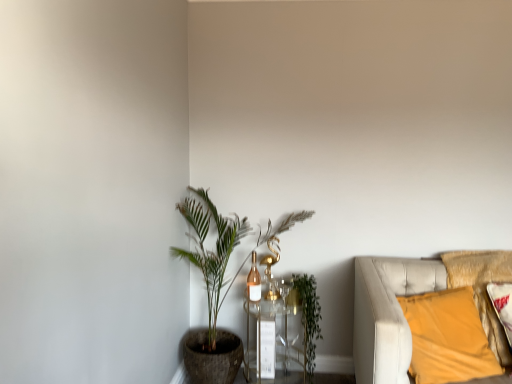
What do you see at coordinates (402, 312) in the screenshot? The image size is (512, 384). I see `velvet yellow pillow at right` at bounding box center [402, 312].

At what (x,y) coordinates should I click in order to perform the action: click on green leafy plant at center-left. Please return your answer as a coordinate pair (x, y). The height and width of the screenshot is (384, 512). Looking at the image, I should click on (211, 257).

What do you see at coordinates (309, 319) in the screenshot? This screenshot has width=512, height=384. I see `green leafy plant at center` at bounding box center [309, 319].

Locate an element on the screen. This screenshot has width=512, height=384. clear glass table at center is located at coordinates (275, 340).

Identify the location of velvet yellow pillow at right. Image resolution: width=512 pixels, height=384 pixels. (402, 312).

Considering the sizes of objects green leafy plant at center-left and green leafy plant at center in the image provided, who is wider, green leafy plant at center-left or green leafy plant at center?

green leafy plant at center-left.

The image size is (512, 384). I want to click on vegetation behind the green leafy plant at center-left, so click(x=309, y=319).

Does green leafy plant at center-left lie behind green leafy plant at center?

No, green leafy plant at center-left is closer to the camera.

Can you confirm if clear glass table at center is wider than velvet yellow pillow at right?

No, clear glass table at center is not wider than velvet yellow pillow at right.

In the scene shown: Considering the sizes of clear glass table at center and velvet yellow pillow at right in the image, is clear glass table at center taller or shorter than velvet yellow pillow at right?

In the image, clear glass table at center appears to be taller than velvet yellow pillow at right.

Is clear glass table at center aimed at velvet yellow pillow at right?

No, clear glass table at center is not facing towards velvet yellow pillow at right.

Where is `studio couch located in front of the clear glass table at center`? This screenshot has height=384, width=512. studio couch located in front of the clear glass table at center is located at coordinates (402, 312).

From a real-world perspective, is green leafy plant at center over velvet yellow pillow at right?

Incorrect, from a real-world perspective, green leafy plant at center is lower than velvet yellow pillow at right.

Is there a large distance between green leafy plant at center and velvet yellow pillow at right?

green leafy plant at center is near velvet yellow pillow at right, not far away.

From the picture: How many degrees apart are the facing directions of green leafy plant at center and velvet yellow pillow at right?

The angular difference between green leafy plant at center and velvet yellow pillow at right is 14.3 degrees.

From the image's perspective, who appears lower, green leafy plant at center or velvet yellow pillow at right?

green leafy plant at center appears lower in the image.

Considering the sizes of objects green leafy plant at center and green leafy plant at center-left in the image provided, who is smaller, green leafy plant at center or green leafy plant at center-left?

green leafy plant at center is smaller.

How different are the orientations of green leafy plant at center and green leafy plant at center-left in degrees?

0.344 degrees.

Considering the positions of objects green leafy plant at center and green leafy plant at center-left in the image provided, who is more to the left, green leafy plant at center or green leafy plant at center-left?

Positioned to the left is green leafy plant at center-left.

Is green leafy plant at center in contact with green leafy plant at center-left?

No.

Which is closer to the camera, (479, 294) or (217, 238)?

The point (479, 294) is more forward.

Considering the sizes of objects velvet yellow pillow at right and green leafy plant at center-left in the image provided, who is wider, velvet yellow pillow at right or green leafy plant at center-left?

green leafy plant at center-left is wider.

From a real-world perspective, is velvet yellow pillow at right positioned under green leafy plant at center-left based on gravity?

Yes, from a real-world perspective, velvet yellow pillow at right is below green leafy plant at center-left.

From the image's perspective, is velvet yellow pillow at right positioned above or below green leafy plant at center-left?

Based on their image positions, velvet yellow pillow at right is located beneath green leafy plant at center-left.

Which point is more forward, (x=304, y=351) or (x=296, y=275)?

The point (x=304, y=351) is in front.

Between clear glass table at center and green leafy plant at center, which one has larger size?

Bigger between the two is clear glass table at center.

From a real-world perspective, does clear glass table at center stand above green leafy plant at center?

No, from a real-world perspective, clear glass table at center is not above green leafy plant at center.

Is clear glass table at center to the left or to the right of green leafy plant at center in the image?

clear glass table at center is positioned on green leafy plant at center's left side.

Would you say clear glass table at center is part of green leafy plant at center-left's contents?

Yes, clear glass table at center is a part of green leafy plant at center-left.

Is green leafy plant at center-left positioned with its back to clear glass table at center?

Yes, green leafy plant at center-left is positioned with its back facing clear glass table at center.

Which object is further away from the camera, green leafy plant at center-left or clear glass table at center?

Positioned behind is clear glass table at center.

In the image, there is a green leafy plant at center. Identify the location of houseplant above it (from the image's perspective). (211, 257).

Locate an element on the screen. The image size is (512, 384). studio couch above the clear glass table at center (from a real-world perspective) is located at coordinates (402, 312).

Considering their positions, is velvet yellow pillow at right positioned closer to clear glass table at center than green leafy plant at center-left?

green leafy plant at center-left is closer to clear glass table at center.

Estimate the real-world distances between objects in this image. Which object is further from velvet yellow pillow at right, green leafy plant at center or green leafy plant at center-left?

Based on the image, green leafy plant at center-left appears to be further to velvet yellow pillow at right.

Based on their spatial positions, is green leafy plant at center or clear glass table at center closer to velvet yellow pillow at right?

The object closer to velvet yellow pillow at right is green leafy plant at center.

From the image, which object appears to be farther from clear glass table at center, green leafy plant at center or velvet yellow pillow at right?

The object further to clear glass table at center is velvet yellow pillow at right.

Which object lies further to the anchor point green leafy plant at center, clear glass table at center or green leafy plant at center-left?

green leafy plant at center-left is further to green leafy plant at center.

Estimate the real-world distances between objects in this image. Which object is closer to clear glass table at center, green leafy plant at center or green leafy plant at center-left?

Among the two, green leafy plant at center is located nearer to clear glass table at center.

Estimate the real-world distances between objects in this image. Which object is further from green leafy plant at center-left, clear glass table at center or velvet yellow pillow at right?

Based on the image, velvet yellow pillow at right appears to be further to green leafy plant at center-left.

Based on their spatial positions, is green leafy plant at center-left or clear glass table at center further from velvet yellow pillow at right?

green leafy plant at center-left lies further to velvet yellow pillow at right than the other object.

Where is `table located between green leafy plant at center-left and green leafy plant at center in the left-right direction`? The width and height of the screenshot is (512, 384). table located between green leafy plant at center-left and green leafy plant at center in the left-right direction is located at coordinates (275, 340).

Locate an element on the screen. The width and height of the screenshot is (512, 384). vegetation situated between clear glass table at center and velvet yellow pillow at right from left to right is located at coordinates (309, 319).

Image resolution: width=512 pixels, height=384 pixels. Find the location of `vegetation located between green leafy plant at center-left and velvet yellow pillow at right in the left-right direction`. vegetation located between green leafy plant at center-left and velvet yellow pillow at right in the left-right direction is located at coordinates (309, 319).

At what (x,y) coordinates should I click in order to perform the action: click on table located between green leafy plant at center-left and velvet yellow pillow at right in the left-right direction. Please return your answer as a coordinate pair (x, y). Looking at the image, I should click on (275, 340).